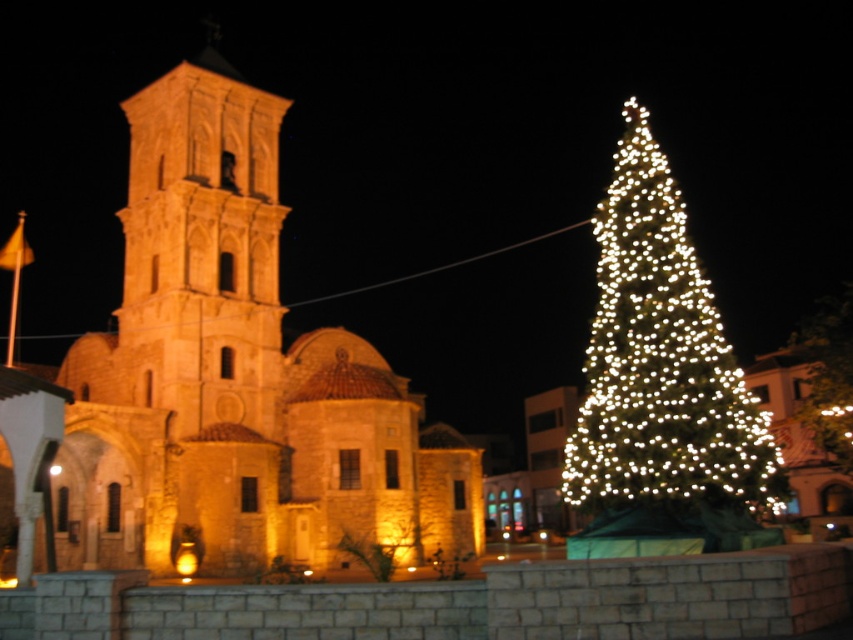
Question: Which is nearer to the illuminated green pine at right?

Choices:
 (A) golden stone church at center
 (B) illuminated glass christmas tree at center

Answer: (A)

Question: Which point is closer to the camera?

Choices:
 (A) golden stone tower at left
 (B) golden stone church at center

Answer: (B)

Question: Which object is farther from the camera taking this photo?

Choices:
 (A) illuminated green pine at right
 (B) illuminated glass christmas tree at center
 (C) golden stone church at center

Answer: (B)

Question: Is golden stone tower at left above illuminated green pine at right?

Choices:
 (A) no
 (B) yes

Answer: (B)

Question: Considering the relative positions of golden stone church at center and illuminated glass christmas tree at center in the image provided, where is golden stone church at center located with respect to illuminated glass christmas tree at center?

Choices:
 (A) above
 (B) below

Answer: (A)

Question: Is golden stone tower at left smaller than illuminated glass christmas tree at center?

Choices:
 (A) no
 (B) yes

Answer: (B)